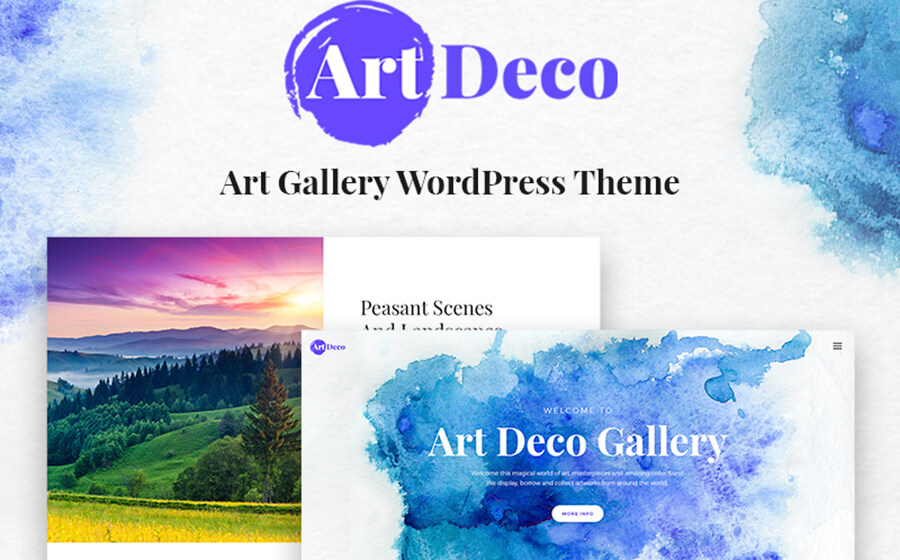
Locate an element on the screen. This screenshot has height=560, width=900. artwork is located at coordinates (649, 377).